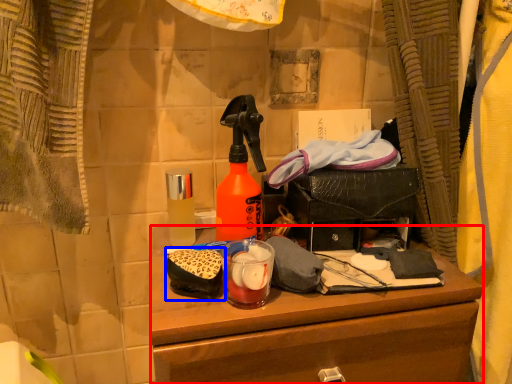
Question: Which of the following is the closest to the observer, desk (highlighted by a red box) or debris (highlighted by a blue box)?

Choices:
 (A) desk
 (B) debris

Answer: (A)